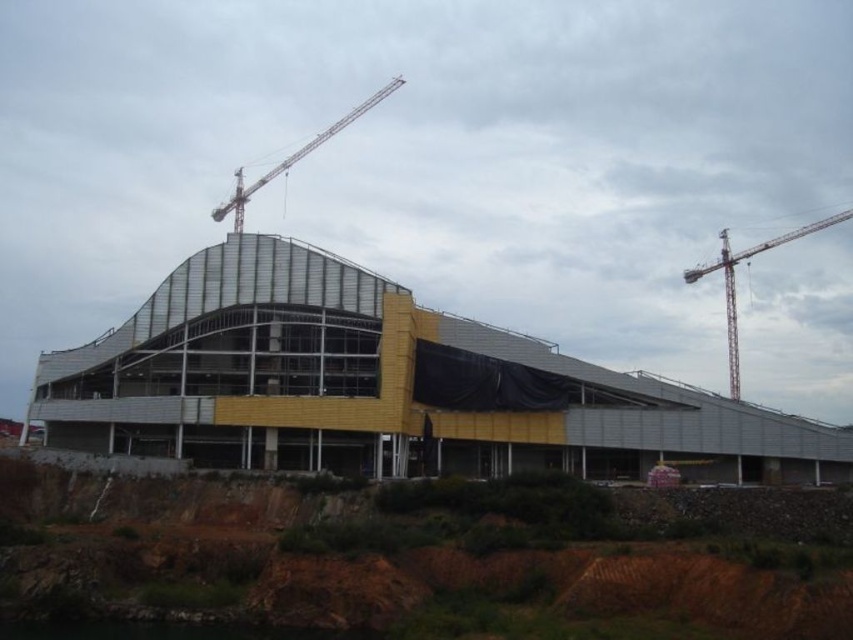
How distant is metallic glass building at center from metallic red crane at upper right?

metallic glass building at center is 280.32 feet from metallic red crane at upper right.

Between point (113, 353) and point (735, 364), which one is positioned behind?

Positioned behind is point (735, 364).

Locate an element on the screen. The width and height of the screenshot is (853, 640). metallic glass building at center is located at coordinates (383, 387).

Image resolution: width=853 pixels, height=640 pixels. What are the coordinates of `metallic glass building at center` in the screenshot? It's located at (383, 387).

Locate an element on the screen. Image resolution: width=853 pixels, height=640 pixels. metallic red crane at upper right is located at coordinates (734, 282).

Between metallic red crane at upper right and metallic gray crane at upper center, which one has less height?

Standing shorter between the two is metallic gray crane at upper center.

Identify the location of metallic red crane at upper right. 734,282.

Which is below, metallic glass building at center or metallic gray crane at upper center?

metallic glass building at center

This screenshot has height=640, width=853. Describe the element at coordinates (383, 387) in the screenshot. I see `metallic glass building at center` at that location.

What do you see at coordinates (383, 387) in the screenshot? This screenshot has width=853, height=640. I see `metallic glass building at center` at bounding box center [383, 387].

Locate an element on the screen. This screenshot has width=853, height=640. metallic glass building at center is located at coordinates (383, 387).